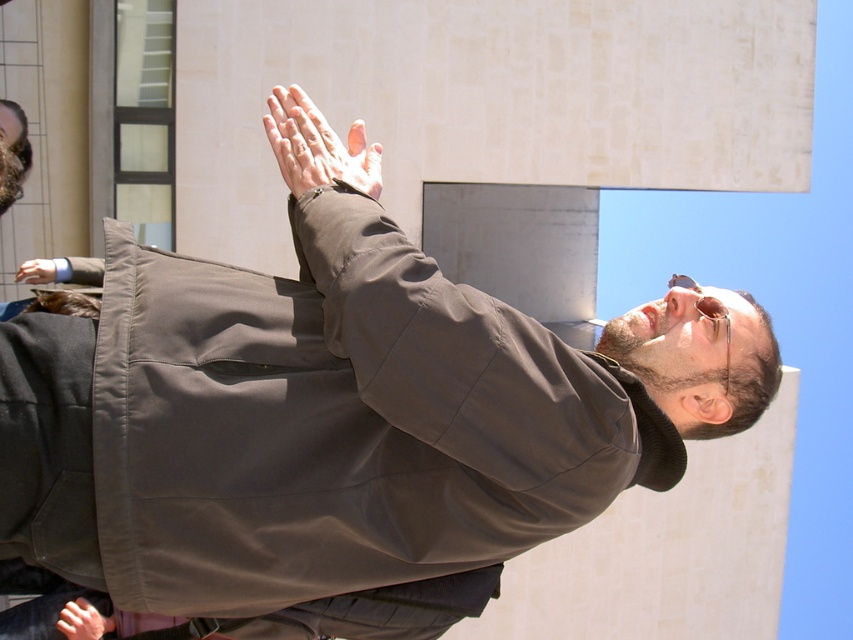
You are a photographer trying to capture a candid shot of the person in the scene. The photographer wants to ensure that both the smooth skin hand at center and the sunglasses at upper center are in focus. Given that the camera has a depth of field that can cover 4 feet, will both objects be in focus?

The distance between the smooth skin hand at center and sunglasses at upper center is 3.92 feet, which is within the camera depth of field of 4 feet. Therefore, both objects will be in focus.

You are a photographer trying to capture the perfect shot of the person in the scene. You notice the smooth skin hand at center and the sunglasses at upper center. Which object should you focus on first if you want to ensure both are in the frame without moving the camera? Explain your reasoning.

The smooth skin hand at center is taller than the sunglasses at upper center, so focusing on the taller object first ensures both will fit within the frame without needing to adjust the camera position.